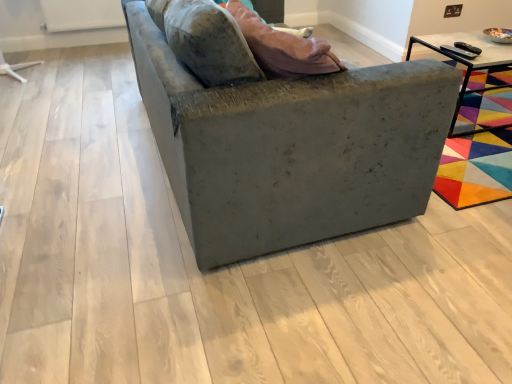
Locate an element on the screen. The width and height of the screenshot is (512, 384). free space in front of velvet gray couch at center is located at coordinates (239, 288).